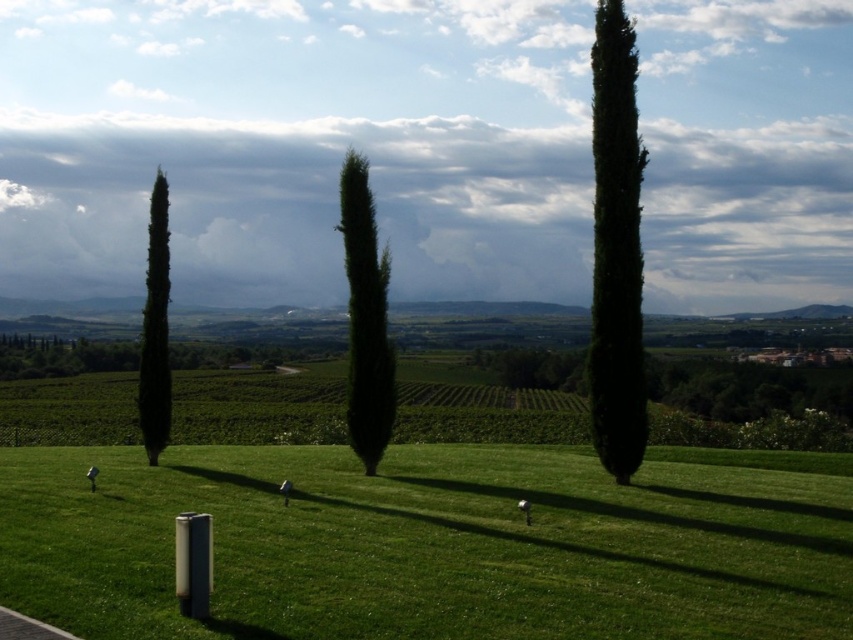
Question: Observing the image, what is the correct spatial positioning of green matte tree at center in reference to green matte tree at left?

Choices:
 (A) below
 (B) above

Answer: (B)

Question: Is dark green textured tree at upper right to the left of green matte tree at left from the viewer's perspective?

Choices:
 (A) yes
 (B) no

Answer: (B)

Question: Which point appears closest to the camera in this image?

Choices:
 (A) pyautogui.click(x=161, y=378)
 (B) pyautogui.click(x=816, y=596)
 (C) pyautogui.click(x=381, y=298)

Answer: (B)

Question: Which point is farther to the camera?

Choices:
 (A) green matte tree at left
 (B) green grassy field at center

Answer: (A)

Question: Can you confirm if dark green textured tree at upper right is positioned below green matte tree at center?

Choices:
 (A) no
 (B) yes

Answer: (A)

Question: Among these objects, which one is farthest from the camera?

Choices:
 (A) green matte tree at center
 (B) dark green textured tree at upper right
 (C) green matte tree at left
 (D) green grassy field at center

Answer: (C)